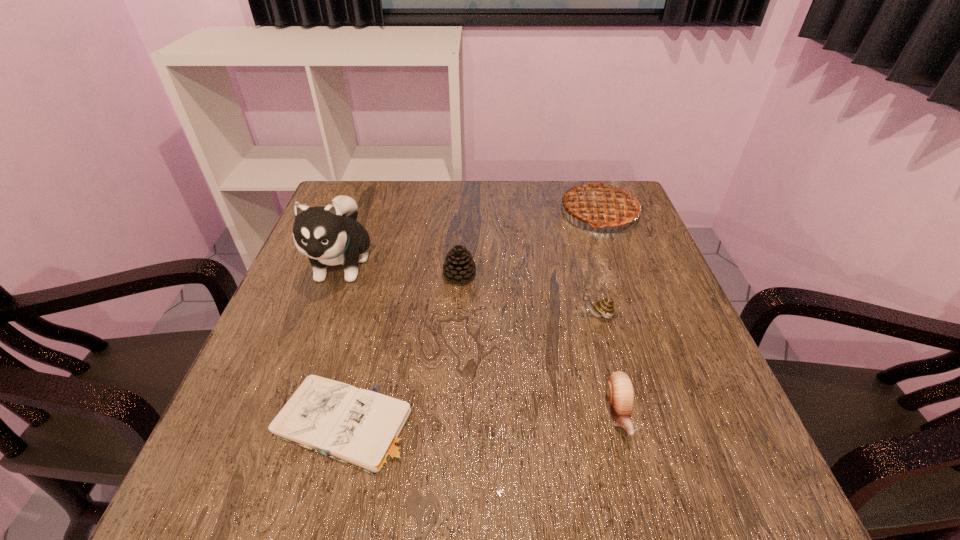
Locate an element on the screen. This screenshot has width=960, height=540. puppy is located at coordinates (330, 235).

At what (x,y) coordinates should I click in order to perform the action: click on pie. Please return your answer as a coordinate pair (x, y). This screenshot has height=540, width=960. Looking at the image, I should click on (604, 203).

Identify the location of pinecone. The width and height of the screenshot is (960, 540). (459, 266).

The width and height of the screenshot is (960, 540). I want to click on the fourth farthest object, so click(605, 307).

Where is `the shorter escargot`? the shorter escargot is located at coordinates (620, 392).

You are a GUI agent. You are given a task and a screenshot of the screen. Output one action in this format:
    pyautogui.click(x=<x>, y=<y>)
    Task: Click on the nearer escargot
    
    Given the screenshot: What is the action you would take?
    pyautogui.click(x=620, y=392)

This screenshot has width=960, height=540. I want to click on the shortest object, so click(x=365, y=429).

Locate an element on the screen. This screenshot has height=540, width=960. free location located at the face of the puppy is located at coordinates (312, 345).

Identify the location of free space located 0.360m on the front of the second tallest object. (647, 347).

You are a GUI agent. You are given a task and a screenshot of the screen. Output one action in this format:
    pyautogui.click(x=<x>, y=<y>)
    Task: Click on the vacant point located at the narrow end of the pinecone
    The width and height of the screenshot is (960, 540).
    Given the screenshot: What is the action you would take?
    pyautogui.click(x=502, y=275)